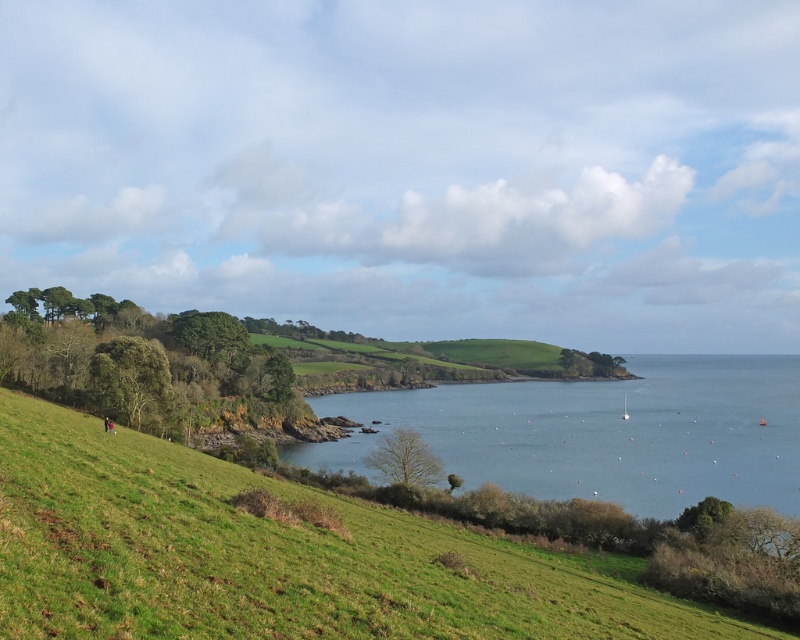
Does green grassy hillside at lower left have a lesser width compared to blue water at center?

Yes.

Is green grassy hillside at lower left to the left of blue water at center from the viewer's perspective?

Yes, green grassy hillside at lower left is to the left of blue water at center.

Is point (106, 458) positioned in front of point (788, 410)?

Yes, it is.

Where is `green grassy hillside at lower left`? The image size is (800, 640). green grassy hillside at lower left is located at coordinates (270, 556).